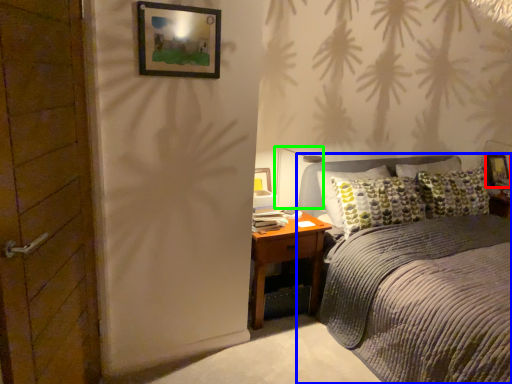
Question: Which object is positioned closest to picture frame (highlighted by a red box)? Select from bed (highlighted by a blue box) and light fixture (highlighted by a green box).

Choices:
 (A) bed
 (B) light fixture

Answer: (B)